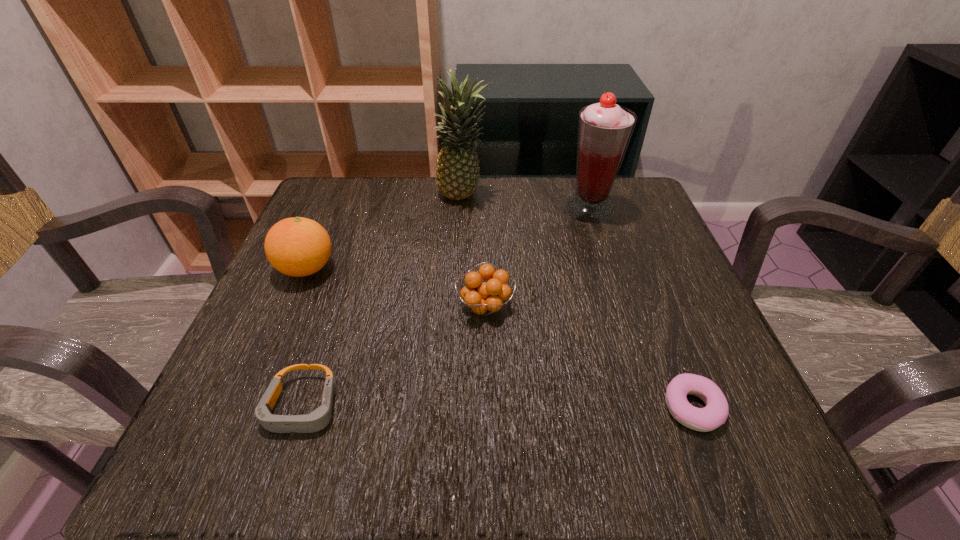
Find the location of a particular element. This screenshot has height=540, width=960. pastry located in the right edge section of the desktop is located at coordinates coord(715,413).

I want to click on object at the near left corner, so click(317, 420).

Image resolution: width=960 pixels, height=540 pixels. In order to click on object situated at the far right corner in this screenshot , I will do click(604, 129).

Find the location of a particular element. object at the near right corner is located at coordinates (715, 413).

In the image, there is a desktop. At what (x,y) coordinates should I click in order to perform the action: click on free space at the far edge. Please return your answer as a coordinate pair (x, y). Looking at the image, I should click on (443, 207).

Where is `vacant space at the near edge of the desktop`? Image resolution: width=960 pixels, height=540 pixels. vacant space at the near edge of the desktop is located at coordinates (476, 429).

Where is `vacant space at the left edge`? vacant space at the left edge is located at coordinates (367, 241).

In order to click on free space at the right edge of the desktop in this screenshot , I will do `click(707, 320)`.

Locate an element on the screen. Image resolution: width=960 pixels, height=540 pixels. free spot at the far left corner of the desktop is located at coordinates (344, 204).

Locate an element on the screen. vacant region at the near left corner of the desktop is located at coordinates (249, 447).